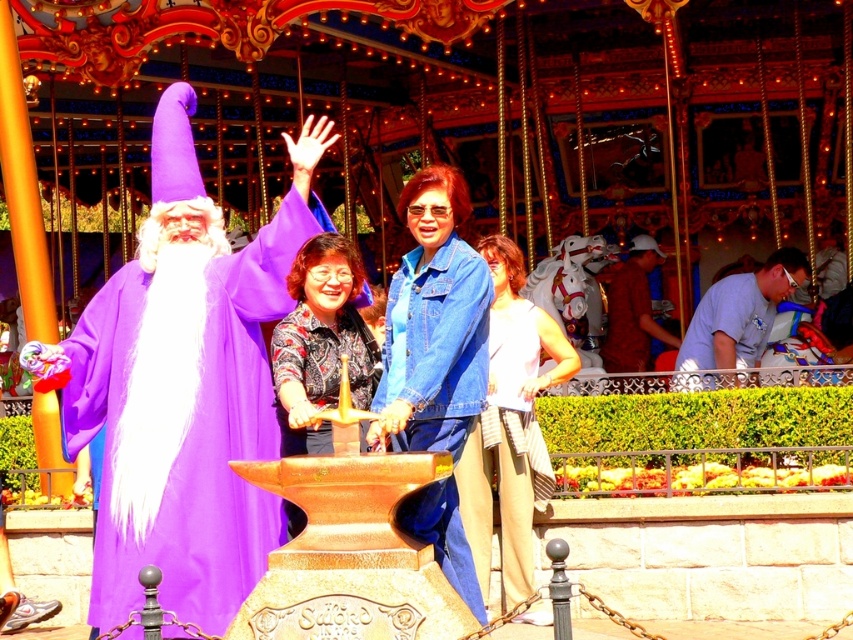
You are a photographer at the theme park and need to ensure that both the white cotton tank top at center and the light blue denim shirt at right are visible in the photo. Based on their heights, which clothing item should you focus on first to ensure both are in frame?

The white cotton tank top at center is taller than the light blue denim shirt at right, so you should focus on positioning the camera to include the taller white cotton tank top at center first, ensuring there is enough space below for the shorter light blue denim shirt at right.

You are standing at the wizard in the theme park and want to move towards the direction of point (241, 253) and point (495, 349). Which point should you move towards first to reach both points in the shortest path?

You should move towards point (241, 253) first because it is in front of point (495, 349), so reaching it first allows you to cover both points efficiently without backtracking.